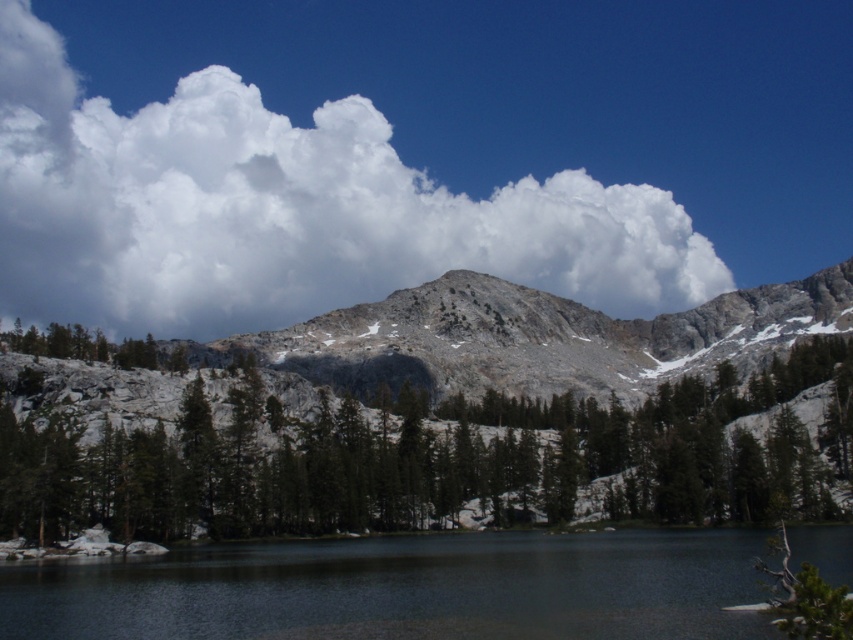
Between green matte tree at center and rocky gray mountain at center, which one has less height?

green matte tree at center

This screenshot has height=640, width=853. I want to click on green matte tree at center, so click(433, 460).

Locate an element on the screen. green matte tree at center is located at coordinates (433, 460).

Does white fluffy cloud at upper center have a greater height compared to green matte tree at center?

Correct, white fluffy cloud at upper center is much taller as green matte tree at center.

Does point (637, 272) lie in front of point (664, 464)?

That is False.

Find the location of a particular element. The image size is (853, 640). white fluffy cloud at upper center is located at coordinates (283, 211).

Find the location of `white fluffy cloud at upper center`. white fluffy cloud at upper center is located at coordinates coord(283,211).

Is white fluffy cloud at upper center further to the viewer compared to rocky gray mountain at center?

Yes, white fluffy cloud at upper center is behind rocky gray mountain at center.

Does point (206, 182) come closer to viewer compared to point (752, 362)?

No.

Locate an element on the screen. The width and height of the screenshot is (853, 640). white fluffy cloud at upper center is located at coordinates (283, 211).